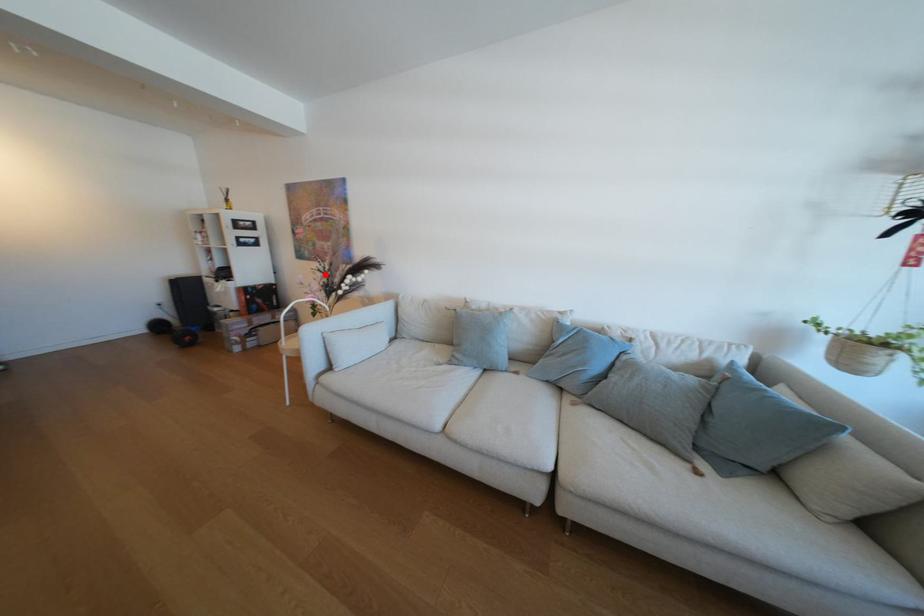
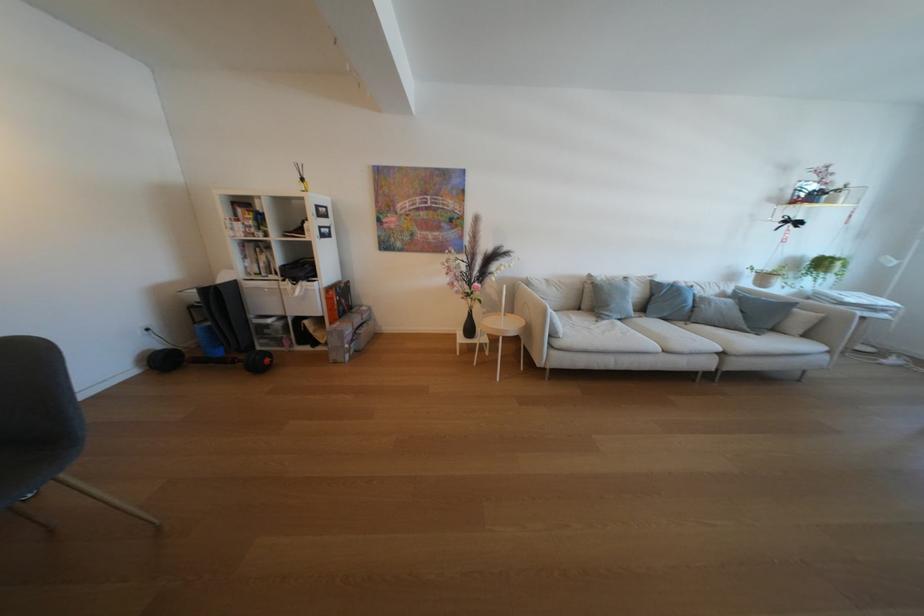
Question: I am providing you with two images of the same scene from different viewpoints. A red point is marked on the first image. Can you still see the location of the red point in image 2?

Choices:
 (A) Yes
 (B) No

Answer: (A)